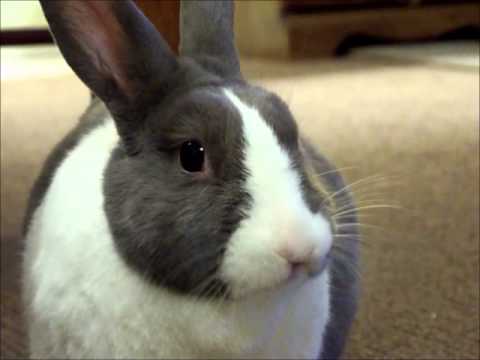
You are a GUI agent. You are given a task and a screenshot of the screen. Output one action in this format:
    pyautogui.click(x=<x>, y=<y>)
    Task: Click on the corner
    The width and height of the screenshot is (480, 360).
    Given the screenshot: What is the action you would take?
    pyautogui.click(x=293, y=31)